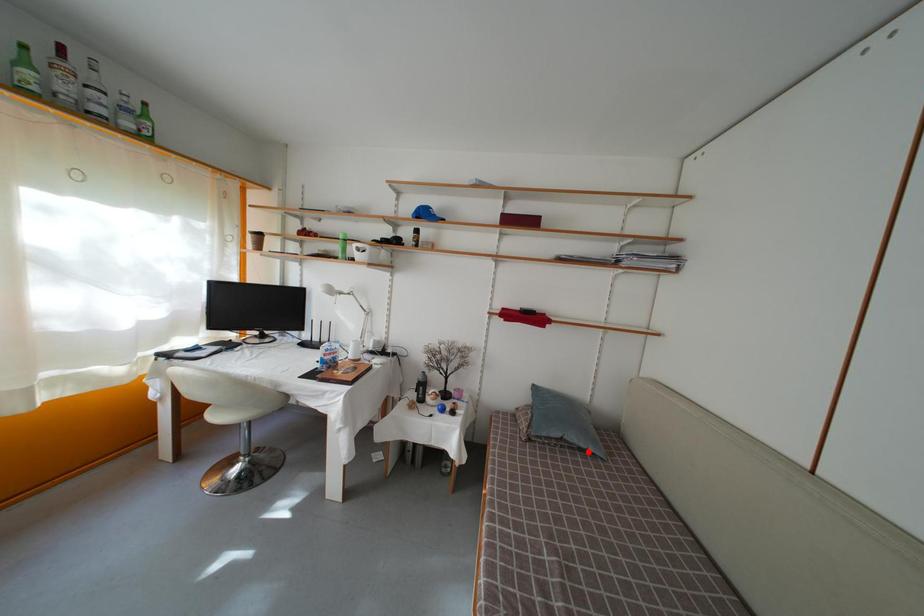
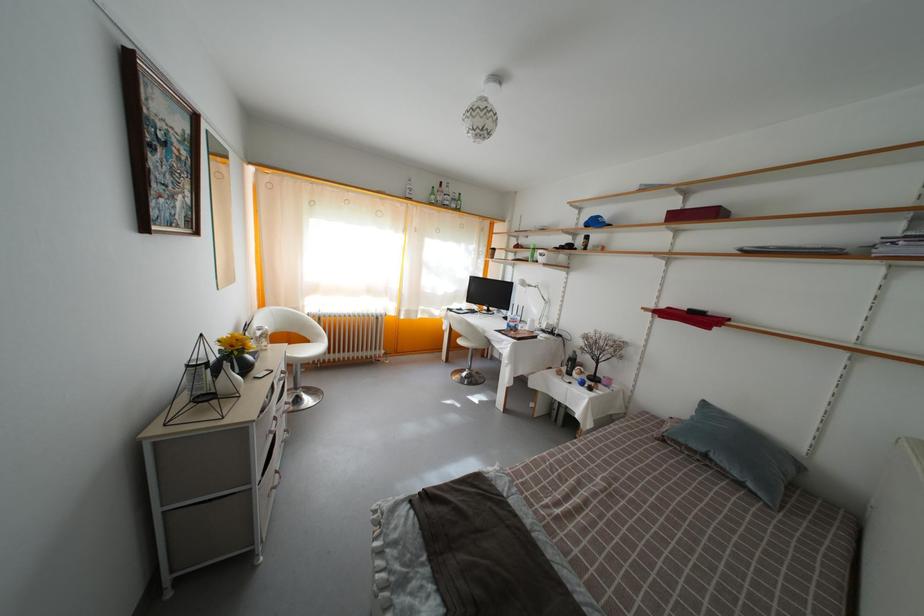
Question: I am providing you with two images of the same scene from different viewpoints. Given a red point in image1, look at the same physical point in image2. Is it:

Choices:
 (A) Closer to the viewpoint
 (B) Farther from the viewpoint

Answer: (B)